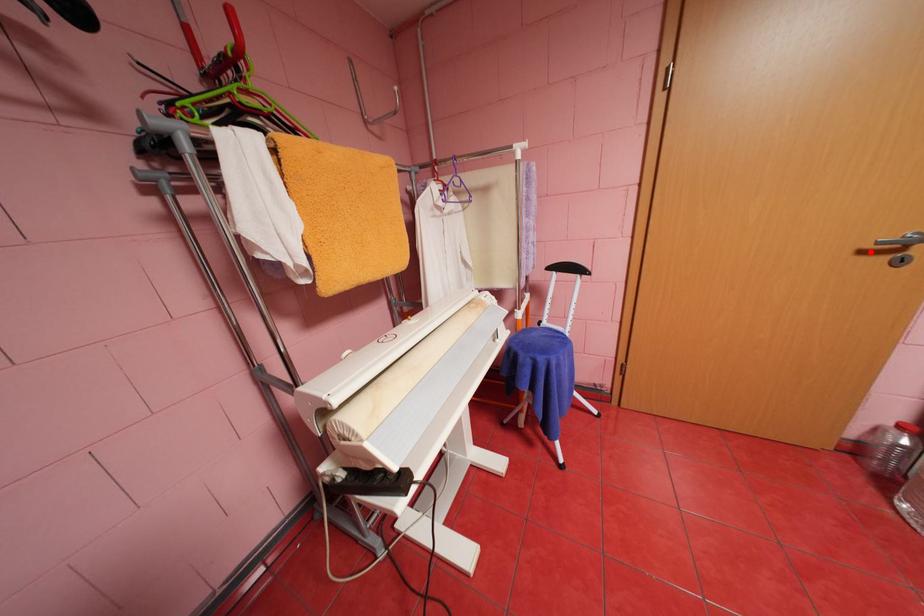
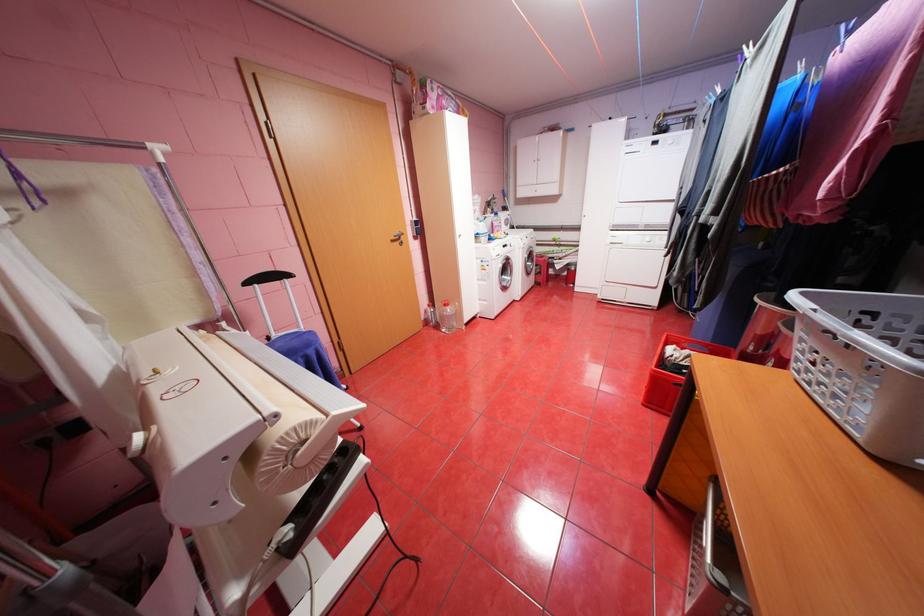
Question: I am providing you with two images of the same scene from different viewpoints. A red point is shown in image1. For the corresponding object point in image2, is it positioned nearer or farther from the camera?

Choices:
 (A) Nearer
 (B) Farther

Answer: (A)